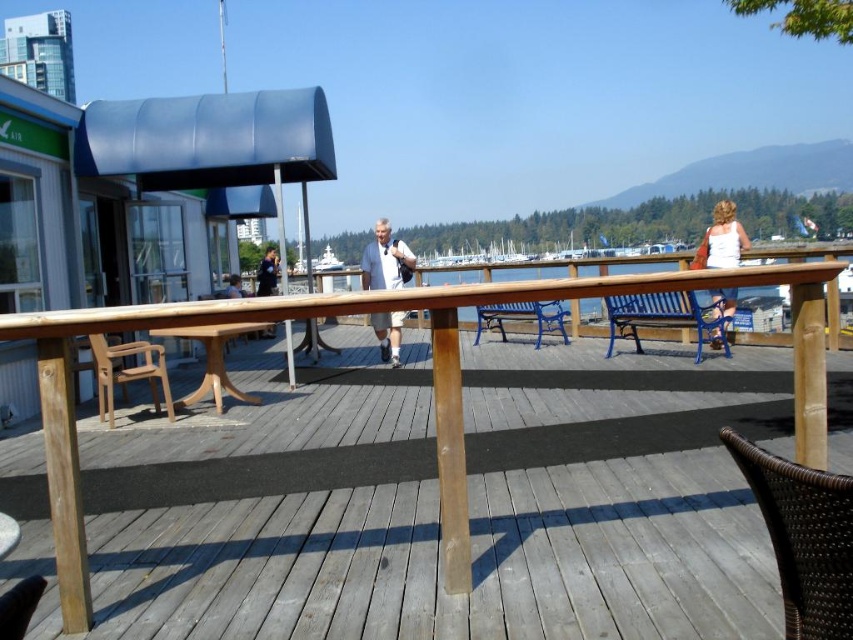
You are a person who wants to sit down at the natural wood table at center and the metallic blue bench at center. Which one is shorter in height?

The natural wood table at center is not as tall as the metallic blue bench at center, so the natural wood table at center is shorter in height.